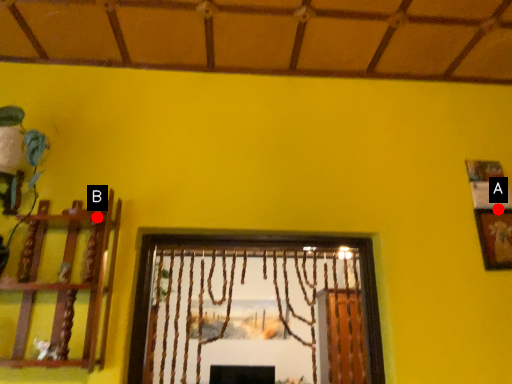
Question: Two points are circled on the image, labeled by A and B beside each circle. Which point is farther from the camera taking this photo?

Choices:
 (A) A is further
 (B) B is further

Answer: (A)